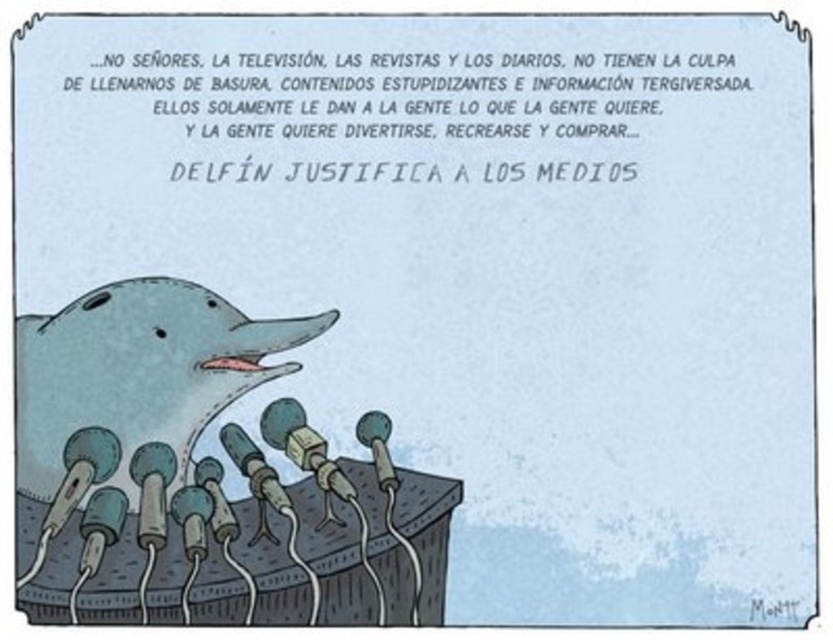
Who is more forward, (288, 456) or (377, 476)?

Positioned in front is point (377, 476).

Image resolution: width=833 pixels, height=640 pixels. Describe the element at coordinates (303, 445) in the screenshot. I see `matte gray microphone at center` at that location.

In order to click on matte gray microphone at center in this screenshot , I will do `click(303, 445)`.

Locate an element on the screen. This screenshot has width=833, height=640. matte gray microphone at center is located at coordinates (303, 445).

Is gray matte dolphin at lower left to the right of matte gray microphone at center from the viewer's perspective?

No, gray matte dolphin at lower left is not to the right of matte gray microphone at center.

Consider the image. Is the position of gray matte dolphin at lower left more distant than that of matte gray microphone at center?

No.

Describe the element at coordinates (138, 371) in the screenshot. I see `gray matte dolphin at lower left` at that location.

Locate an element on the screen. The width and height of the screenshot is (833, 640). gray matte dolphin at lower left is located at coordinates (138, 371).

Does point (166, 352) come in front of point (378, 424)?

Yes, point (166, 352) is closer to viewer.

How far apart are gray matte dolphin at lower left and metallic gray microphone at center?

A distance of 7.47 inches exists between gray matte dolphin at lower left and metallic gray microphone at center.

The image size is (833, 640). Find the location of `gray matte dolphin at lower left`. gray matte dolphin at lower left is located at coordinates (138, 371).